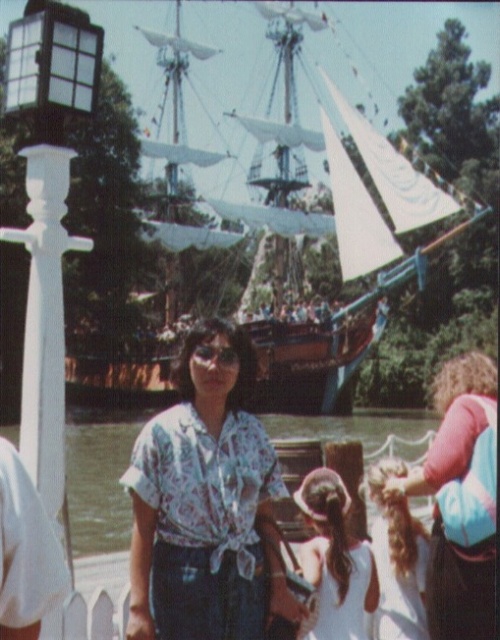
Can you confirm if curly hair at center is thinner than white fabric dress at center?

No.

What are the coordinates of `curly hair at center` in the screenshot? It's located at (444, 509).

The image size is (500, 640). In order to click on curly hair at center in this screenshot , I will do `click(444, 509)`.

Locate an element on the screen. This screenshot has width=500, height=640. wooden ship at center is located at coordinates 309,365.

Who is positioned more to the right, wooden ship at center or blonde hair at lower right?

blonde hair at lower right

Between point (112, 253) and point (393, 618), which one is positioned behind?

The point (112, 253) is more distant.

This screenshot has height=640, width=500. I want to click on wooden ship at center, so click(x=309, y=365).

Who is positioned more to the left, white fabric dress at center or blonde hair at lower right?

From the viewer's perspective, white fabric dress at center appears more on the left side.

Who is more distant from viewer, (342, 525) or (383, 625)?

Positioned behind is point (342, 525).

Does point (322, 536) lie behind point (391, 524)?

No, (322, 536) is in front of (391, 524).

The height and width of the screenshot is (640, 500). Identify the location of white fabric dress at center. (335, 560).